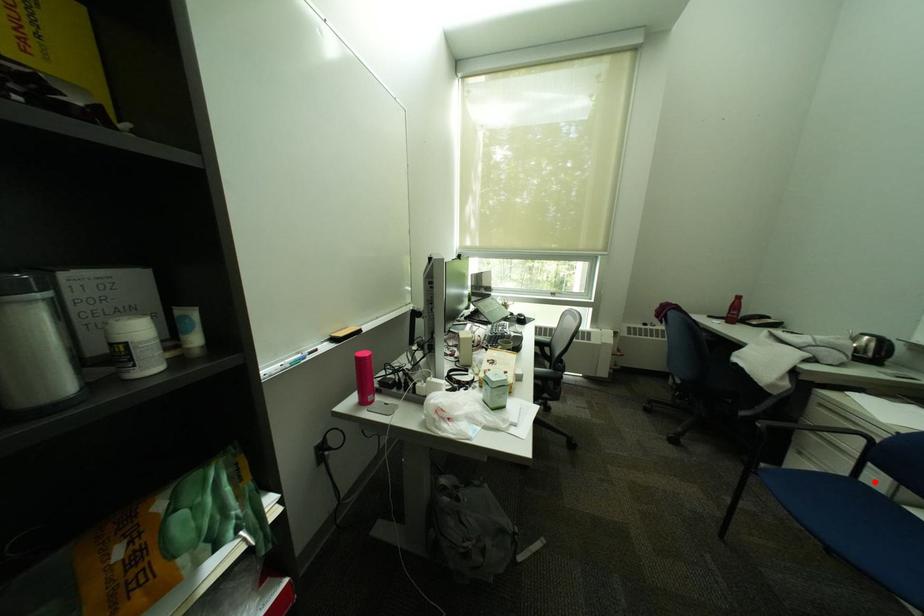
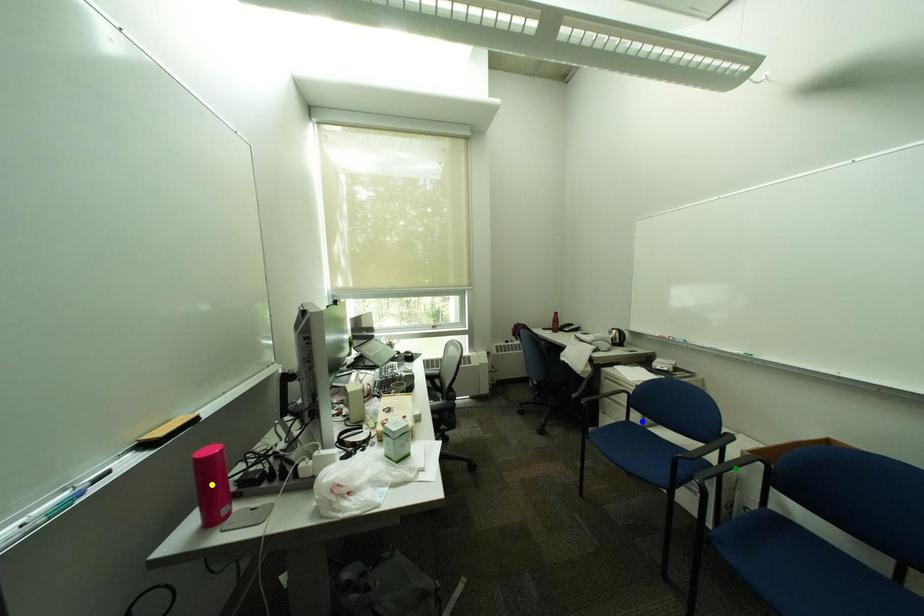
Question: I am providing you with two images of the same scene from different viewpoints. A red point is marked on the first image. You are given multiple points on the second image. Which point in image 2 is actually the same real-world point as the red point in image 1?

Choices:
 (A) blue point
 (B) green point
 (C) yellow point

Answer: (A)